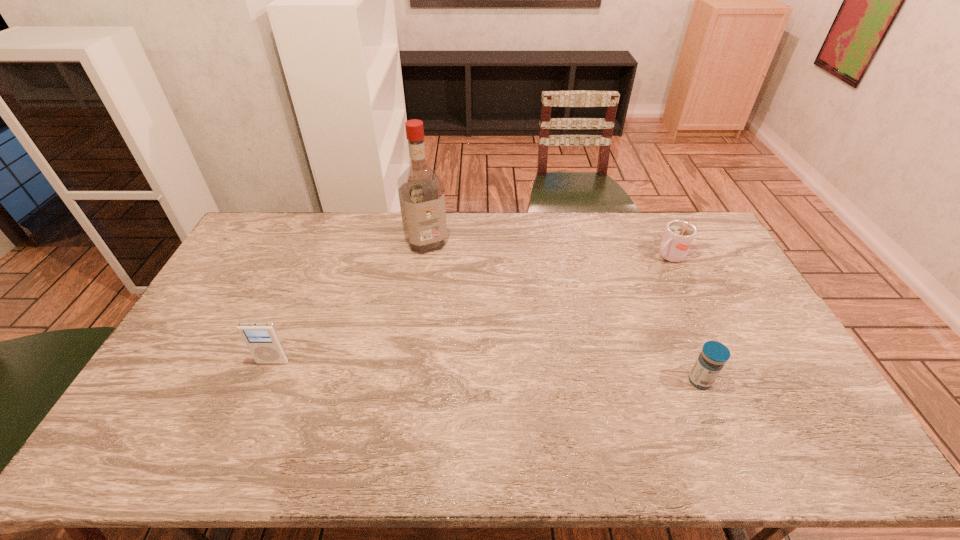
Where is `free spot on the desktop that is between the leftmost object and the nearest object and is positioned on the side with the handle of the cup`? This screenshot has height=540, width=960. free spot on the desktop that is between the leftmost object and the nearest object and is positioned on the side with the handle of the cup is located at coordinates (501, 372).

Identify the location of vacant space on the desktop that is between the leftmost object and the medicine and is positioned on the front-facing side of the second object from left to right. The width and height of the screenshot is (960, 540). (494, 372).